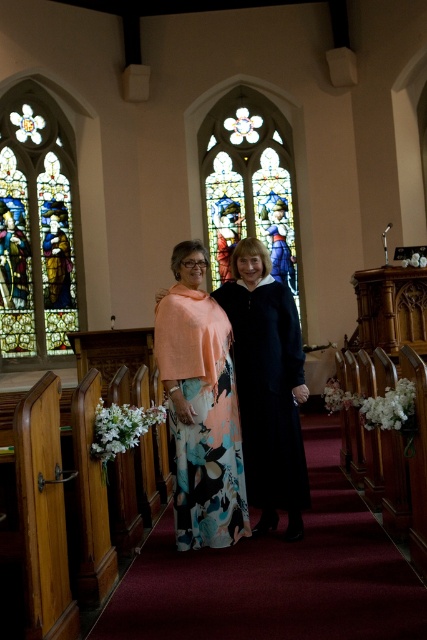
Is floral-patterned fabric at center closer to the viewer compared to floral-patterned fabric dress at center?

That is True.

Locate an element on the screen. The image size is (427, 640). floral-patterned fabric at center is located at coordinates (277, 573).

Between floral-patterned fabric at center and stained glass window at left, which one is positioned lower?

floral-patterned fabric at center is below.

Who is more forward, (348, 577) or (29, 305)?

Point (348, 577) is more forward.

Which is behind, point (266, 556) or point (46, 278)?

The point (46, 278) is more distant.

Where is `floral-patterned fabric at center`? The image size is (427, 640). floral-patterned fabric at center is located at coordinates (277, 573).

Is point (263, 621) closer to viewer compared to point (284, 369)?

Yes, it is.

Is floral-patterned fabric at center thinner than black satin dress at center?

In fact, floral-patterned fabric at center might be wider than black satin dress at center.

Where is `floral-patterned fabric at center`? The image size is (427, 640). floral-patterned fabric at center is located at coordinates click(277, 573).

Locate an element on the screen. This screenshot has height=640, width=427. floral-patterned fabric at center is located at coordinates (277, 573).